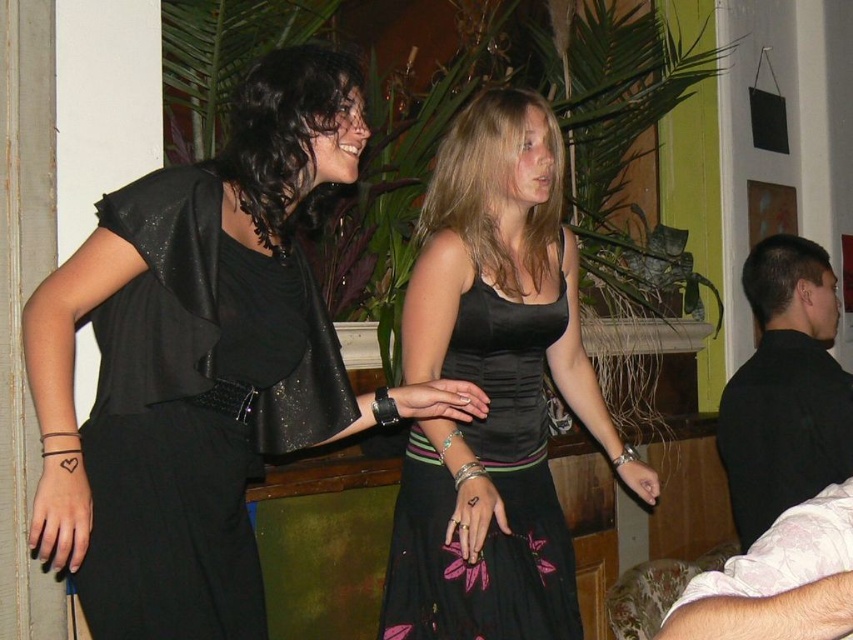
Question: Can you confirm if black textured dress at center is positioned to the right of black smooth shirt at right?

Choices:
 (A) no
 (B) yes

Answer: (A)

Question: Estimate the real-world distances between objects in this image. Which object is closer to the light pink floral shirt at lower right?

Choices:
 (A) black leather dress at left
 (B) black textured dress at center
 (C) black smooth shirt at right

Answer: (B)

Question: Which of the following is the farthest from the observer?

Choices:
 (A) light pink floral shirt at lower right
 (B) black leather dress at left
 (C) black textured dress at center

Answer: (C)

Question: Considering the relative positions of black textured dress at center and black smooth shirt at right in the image provided, where is black textured dress at center located with respect to black smooth shirt at right?

Choices:
 (A) below
 (B) above

Answer: (A)

Question: Estimate the real-world distances between objects in this image. Which object is farther from the light pink floral shirt at lower right?

Choices:
 (A) black leather dress at left
 (B) black textured dress at center

Answer: (A)

Question: Can you confirm if black leather dress at left is positioned below black smooth shirt at right?

Choices:
 (A) no
 (B) yes

Answer: (A)